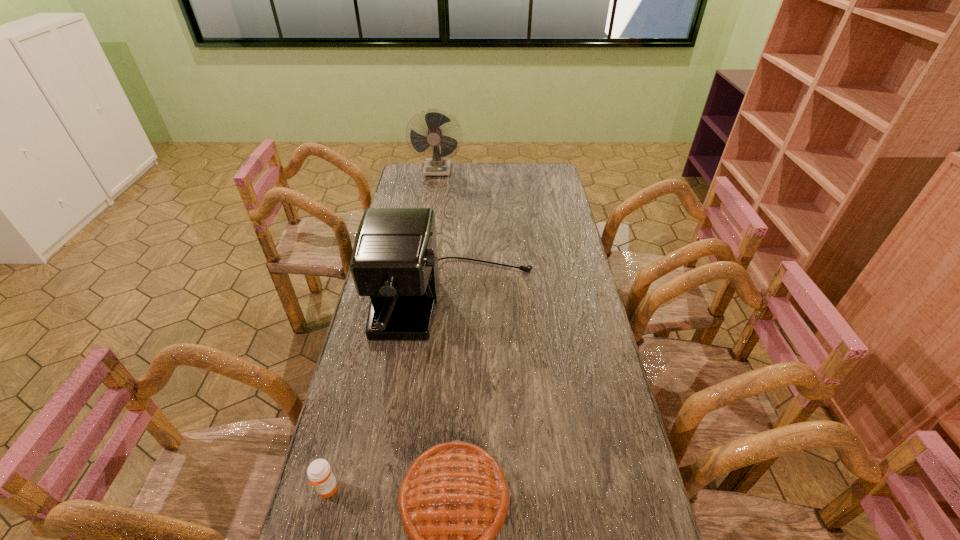
Find the location of `object at the far left corner`. object at the far left corner is located at coordinates (437, 165).

Where is `free space at the left edge of the desktop`? Image resolution: width=960 pixels, height=540 pixels. free space at the left edge of the desktop is located at coordinates (417, 193).

Find the location of `vacant space at the right edge of the desktop`. vacant space at the right edge of the desktop is located at coordinates (626, 525).

This screenshot has width=960, height=540. What are the coordinates of `vacant space at the far right corner of the desktop` in the screenshot? It's located at (550, 179).

In order to click on vacant area that lies between the fan and the second farthest object in this screenshot , I will do `click(445, 237)`.

Locate an element on the screen. The image size is (960, 540). vacant area between the fan and the third nearest object is located at coordinates (445, 237).

This screenshot has height=540, width=960. What are the coordinates of `vacant area that lies between the coffee maker and the fan` in the screenshot? It's located at (445, 237).

This screenshot has width=960, height=540. I want to click on free space between the coffee maker and the fan, so (x=445, y=237).

Locate an element on the screen. The width and height of the screenshot is (960, 540). vacant area between the medicine and the second farthest object is located at coordinates (391, 397).

Locate which object ranks second in proximity to the third nearest object. Please provide its 2D coordinates. Your answer should be formatted as a tuple, i.e. [(x, y)], where the tuple contains the x and y coordinates of a point satisfying the conditions above.

[(319, 472)]